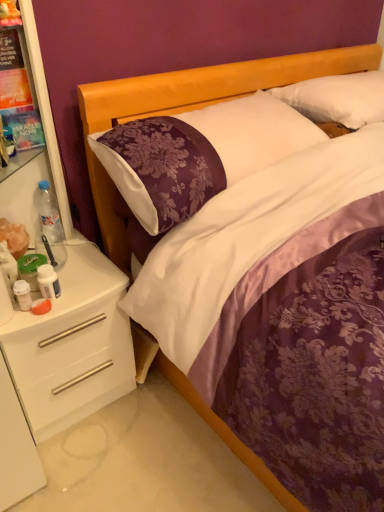
Question: Considering the relative sizes of purple satin pillow at center, which is the 2th pillow from right to left, and white soft pillow at upper right, which is the 1th pillow from right to left, in the image provided, is purple satin pillow at center, which is the 2th pillow from right to left, shorter than white soft pillow at upper right, which is the 1th pillow from right to left,?

Choices:
 (A) no
 (B) yes

Answer: (A)

Question: From a real-world perspective, is purple satin pillow at center, which is the 2th pillow from right to left, physically above white soft pillow at upper right, marked as the 2th pillow in a left-to-right arrangement?

Choices:
 (A) no
 (B) yes

Answer: (A)

Question: Considering the relative sizes of purple satin pillow at center, which is the 2th pillow from right to left, and white soft pillow at upper right, marked as the 2th pillow in a left-to-right arrangement, in the image provided, is purple satin pillow at center, which is the 2th pillow from right to left, thinner than white soft pillow at upper right, marked as the 2th pillow in a left-to-right arrangement,?

Choices:
 (A) no
 (B) yes

Answer: (A)

Question: Does purple satin pillow at center, the 1th pillow viewed from the left, turn towards white soft pillow at upper right, marked as the 2th pillow in a left-to-right arrangement?

Choices:
 (A) yes
 (B) no

Answer: (B)

Question: Is purple satin pillow at center, which is the 2th pillow from right to left, turned away from white soft pillow at upper right, marked as the 2th pillow in a left-to-right arrangement?

Choices:
 (A) yes
 (B) no

Answer: (B)

Question: Is purple satin pillow at center, which is the 2th pillow from right to left, not inside white soft pillow at upper right, marked as the 2th pillow in a left-to-right arrangement?

Choices:
 (A) yes
 (B) no

Answer: (A)

Question: Is white glossy drawer at lower left positioned beyond the bounds of purple satin pillow at center, which is the 2th pillow from right to left?

Choices:
 (A) no
 (B) yes

Answer: (B)

Question: Does white glossy drawer at lower left have a lesser height compared to purple satin pillow at center, which is the 2th pillow from right to left?

Choices:
 (A) yes
 (B) no

Answer: (B)

Question: Is the position of white glossy drawer at lower left less distant than that of purple satin pillow at center, which is the 2th pillow from right to left?

Choices:
 (A) yes
 (B) no

Answer: (B)

Question: From a real-world perspective, does white glossy drawer at lower left stand above purple satin pillow at center, the 1th pillow viewed from the left?

Choices:
 (A) no
 (B) yes

Answer: (A)

Question: From a real-world perspective, is white glossy drawer at lower left located beneath purple satin pillow at center, which is the 2th pillow from right to left?

Choices:
 (A) no
 (B) yes

Answer: (B)

Question: Is white glossy drawer at lower left beside purple satin pillow at center, which is the 2th pillow from right to left?

Choices:
 (A) no
 (B) yes

Answer: (A)

Question: Could you tell me if purple satin bed at center is facing white glossy drawer at lower left?

Choices:
 (A) no
 (B) yes

Answer: (A)